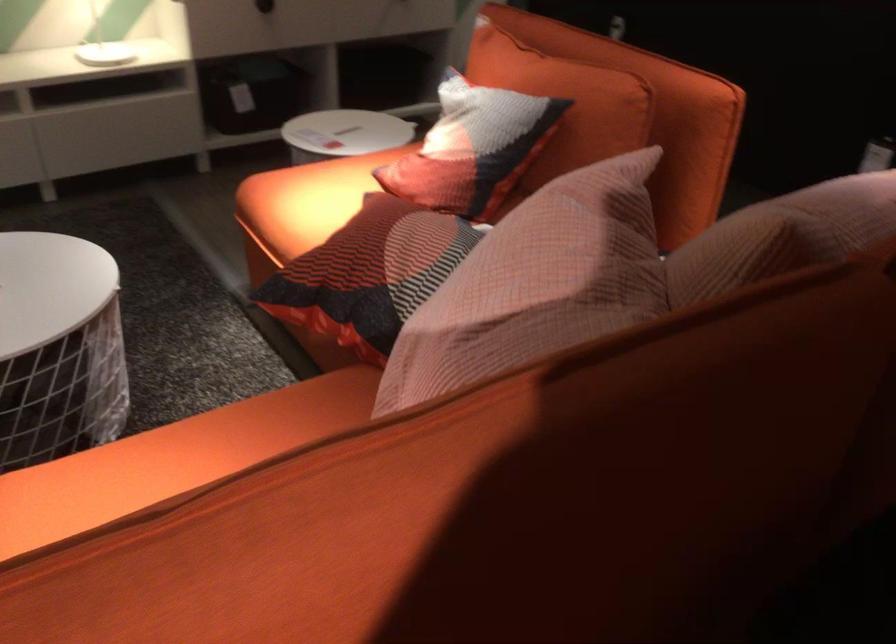
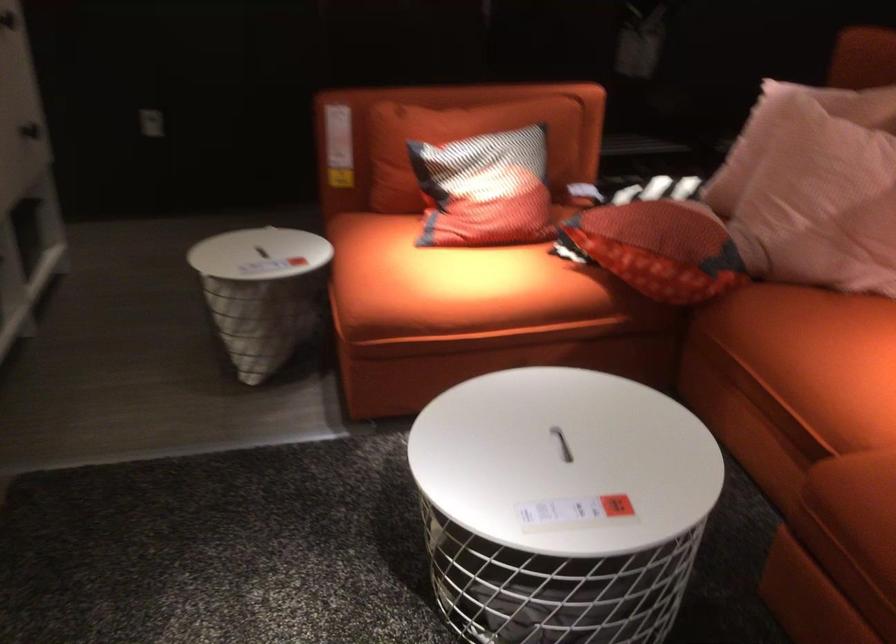
Question: I am providing you with two images of the same scene from different viewpoints. Which of the following objects are not visible in image2?

Choices:
 (A) white basket lid handle
 (B) sofa sitting surface
 (C) red patterned pillow
 (D) glass beer bottle

Answer: (B)